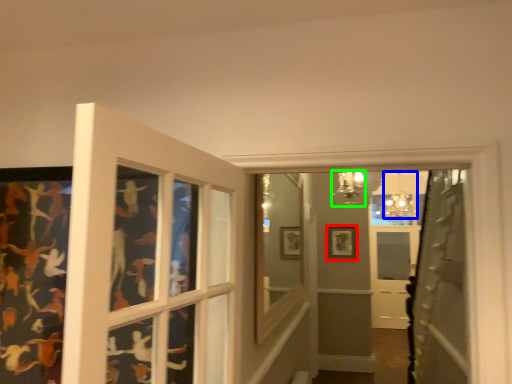
Question: Which object is the closest to the picture frame (highlighted by a red box)? Choose among these: light fixture (highlighted by a blue box) or light fixture (highlighted by a green box).

Choices:
 (A) light fixture
 (B) light fixture

Answer: (A)